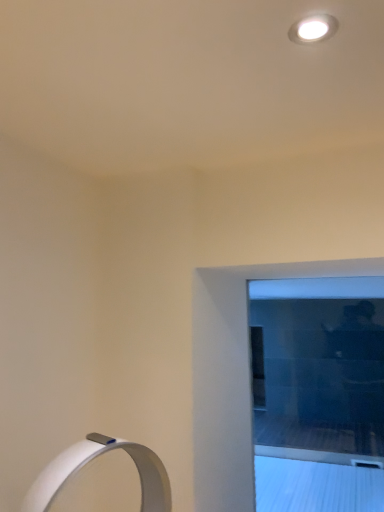
The height and width of the screenshot is (512, 384). I want to click on transparent glass door at upper right, so click(x=318, y=393).

This screenshot has width=384, height=512. What do you see at coordinates (318, 393) in the screenshot?
I see `transparent glass door at upper right` at bounding box center [318, 393].

What are the coordinates of `transparent glass door at upper right` in the screenshot? It's located at (318, 393).